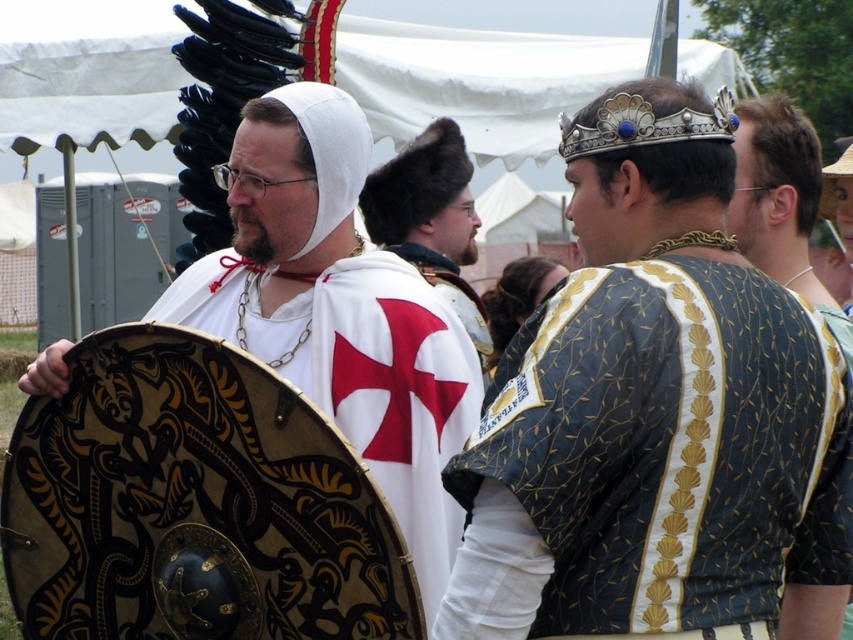
Question: Does gold embroidered tunic at center appear under white matte/soft cloth at center?

Choices:
 (A) no
 (B) yes

Answer: (A)

Question: From the image, what is the correct spatial relationship of gold embroidered tunic at center in relation to white matte/soft cloth at center?

Choices:
 (A) above
 (B) below

Answer: (A)

Question: Which point appears farthest from the camera in this image?

Choices:
 (A) (465, 316)
 (B) (289, 102)
 (C) (692, 612)

Answer: (A)

Question: Estimate the real-world distances between objects in this image. Which object is farther from the gold embroidered tunic at center?

Choices:
 (A) white cloth at center
 (B) white matte/soft cloth at center

Answer: (A)

Question: Is gold embroidered tunic at center further to the viewer compared to white matte/soft cloth at center?

Choices:
 (A) no
 (B) yes

Answer: (A)

Question: Which point appears farthest from the camera in this image?

Choices:
 (A) (325, 141)
 (B) (437, 173)
 (C) (627, 84)

Answer: (B)